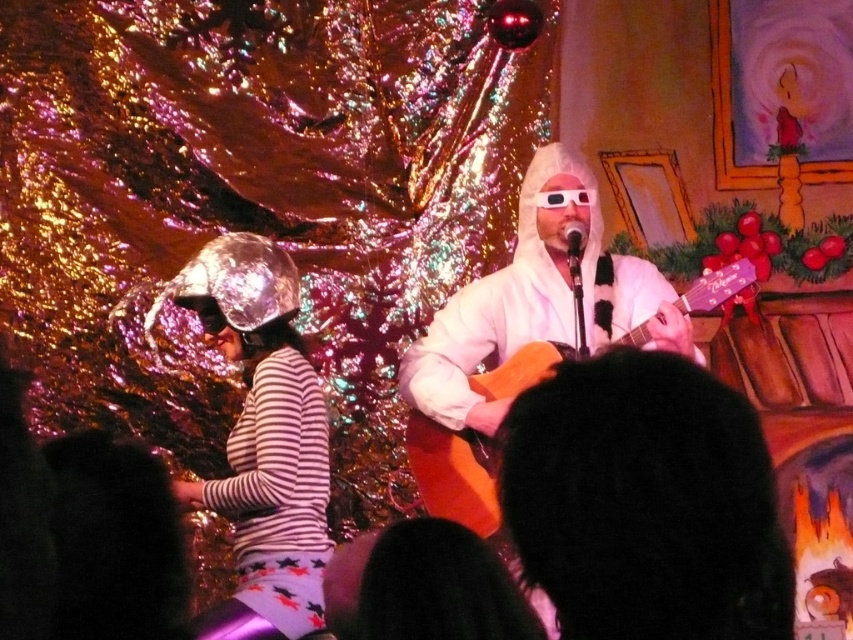
Question: Which point is closer to the camera taking this photo?

Choices:
 (A) (241, 444)
 (B) (549, 342)

Answer: (A)

Question: Can you confirm if shiny metallic helmet at left is wider than metallic silver microphone at center?

Choices:
 (A) no
 (B) yes

Answer: (B)

Question: Which of these objects is positioned closest to the shiny metallic helmet at left?

Choices:
 (A) black fuzzy hat at center
 (B) metallic silver microphone at center
 (C) matte orange acoustic guitar at center

Answer: (C)

Question: Among these points, which one is nearest to the camera?

Choices:
 (A) (582, 252)
 (B) (231, 257)
 (C) (602, 358)

Answer: (C)

Question: Does black fuzzy hat at center have a greater width compared to shiny metallic helmet at left?

Choices:
 (A) no
 (B) yes

Answer: (B)

Question: In this image, where is shiny metallic helmet at left located relative to matte orange acoustic guitar at center?

Choices:
 (A) above
 (B) below

Answer: (B)